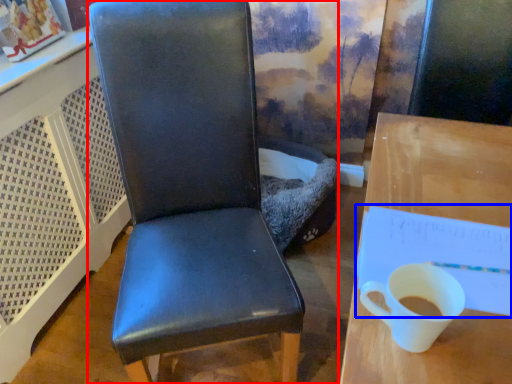
Question: Which of the following is the closest to the observer, chair (highlighted by a red box) or notepad (highlighted by a blue box)?

Choices:
 (A) chair
 (B) notepad

Answer: (A)